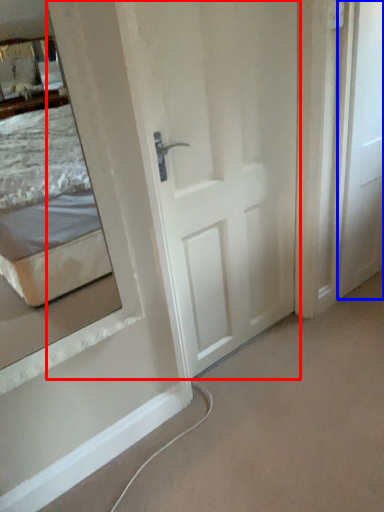
Question: Which object appears farthest to the camera in this image, door (highlighted by a red box) or door (highlighted by a blue box)?

Choices:
 (A) door
 (B) door

Answer: (B)